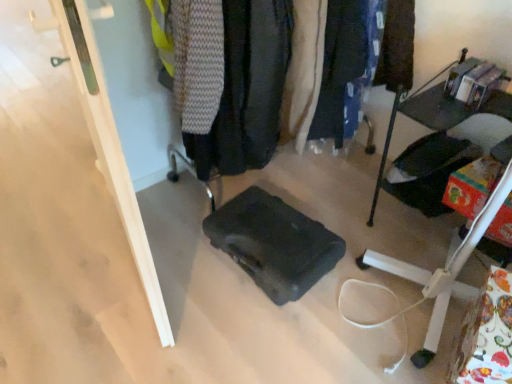
The height and width of the screenshot is (384, 512). What do you see at coordinates (247, 89) in the screenshot?
I see `dark gray fabric jacket at center, placed as the second clothing when sorted from right to left` at bounding box center [247, 89].

Describe the element at coordinates (274, 243) in the screenshot. I see `black matte suitcase at center` at that location.

Describe the element at coordinates (247, 89) in the screenshot. The image size is (512, 384). I see `dark gray fabric at center` at that location.

Identify the location of dark blue fabric pants at center, which is the 1th clothing from right to left. (341, 70).

Which of these two, dark gray fabric jacket at center, placed as the second clothing when sorted from right to left, or metallic black shelf at right, stands taller?

Standing taller between the two is dark gray fabric jacket at center, placed as the second clothing when sorted from right to left.

From a real-world perspective, is dark gray fabric jacket at center, which appears as the 1th clothing when viewed from the left, above or below metallic black shelf at right?

From a real-world perspective, dark gray fabric jacket at center, which appears as the 1th clothing when viewed from the left, is physically above metallic black shelf at right.

Between dark gray fabric jacket at center, placed as the second clothing when sorted from right to left, and metallic black shelf at right, which one has smaller width?

With smaller width is metallic black shelf at right.

Who is more distant, dark gray fabric jacket at center, which appears as the 1th clothing when viewed from the left, or black matte suitcase at center?

black matte suitcase at center.

From the image's perspective, does dark gray fabric jacket at center, placed as the second clothing when sorted from right to left, appear higher than black matte suitcase at center?

Yes, from the image's perspective, dark gray fabric jacket at center, placed as the second clothing when sorted from right to left, is above black matte suitcase at center.

Is dark gray fabric jacket at center, placed as the second clothing when sorted from right to left, taller than black matte suitcase at center?

Indeed, dark gray fabric jacket at center, placed as the second clothing when sorted from right to left, has a greater height compared to black matte suitcase at center.

What's the angular difference between dark gray fabric jacket at center, which appears as the 1th clothing when viewed from the left, and black matte suitcase at center's facing directions?

The angular difference between dark gray fabric jacket at center, which appears as the 1th clothing when viewed from the left, and black matte suitcase at center is 64.2 degrees.

Looking at this image, choose the correct answer: Is dark blue fabric pants at center, which is the 1th clothing from right to left, inside metallic black shelf at right or outside it?

dark blue fabric pants at center, which is the 1th clothing from right to left, lies outside metallic black shelf at right.

From the picture: Visually, is dark blue fabric pants at center, which is the 1th clothing from right to left, positioned to the left or to the right of metallic black shelf at right?

dark blue fabric pants at center, which is the 1th clothing from right to left, is to the left of metallic black shelf at right.

Which is nearer, (349,137) or (490,215)?

Point (349,137) is positioned farther from the camera compared to point (490,215).

Which of these two, dark blue fabric pants at center, which is the 1th clothing from right to left, or metallic black shelf at right, is thinner?

With smaller width is dark blue fabric pants at center, which is the 1th clothing from right to left.

Is metallic black shelf at right outside of dark gray fabric at center?

Yes, metallic black shelf at right is outside of dark gray fabric at center.

Is dark gray fabric at center at the back of metallic black shelf at right?

No.

Which object is thinner, metallic black shelf at right or dark gray fabric at center?

dark gray fabric at center.

Which is farther from the camera, (454, 253) or (264, 125)?

The point (264, 125) is farther from the camera.

Which is closer, (x=307, y=277) or (x=437, y=310)?

Point (x=307, y=277).

Is black matte suitcase at center positioned far away from metallic black shelf at right?

black matte suitcase at center is actually quite close to metallic black shelf at right.

From a real-world perspective, is black matte suitcase at center above or below metallic black shelf at right?

Clearly, from a real-world perspective, black matte suitcase at center is below metallic black shelf at right.

Based on the photo, from the image's perspective, is black matte suitcase at center over metallic black shelf at right?

No, from the image's perspective, black matte suitcase at center is not over metallic black shelf at right.

Is dark gray fabric at center shorter than dark blue fabric pants at center, positioned as the 2th clothing in left-to-right order?

In fact, dark gray fabric at center may be taller than dark blue fabric pants at center, positioned as the 2th clothing in left-to-right order.

Would you say dark gray fabric at center is inside or outside dark blue fabric pants at center, which is the 1th clothing from right to left?

dark gray fabric at center exists outside the volume of dark blue fabric pants at center, which is the 1th clothing from right to left.

Is dark gray fabric at center thinner than dark blue fabric pants at center, positioned as the 2th clothing in left-to-right order?

No.

In the image, is dark gray fabric at center positioned in front of or behind dark blue fabric pants at center, positioned as the 2th clothing in left-to-right order?

Clearly, dark gray fabric at center is in front of dark blue fabric pants at center, positioned as the 2th clothing in left-to-right order.

In the image, is dark blue fabric pants at center, which is the 1th clothing from right to left, on the left side or the right side of black matte suitcase at center?

dark blue fabric pants at center, which is the 1th clothing from right to left, is to the right of black matte suitcase at center.

Based on the photo, from the image's perspective, is dark blue fabric pants at center, positioned as the 2th clothing in left-to-right order, above or below black matte suitcase at center?

dark blue fabric pants at center, positioned as the 2th clothing in left-to-right order, is above black matte suitcase at center.

Which is correct: dark blue fabric pants at center, which is the 1th clothing from right to left, is inside black matte suitcase at center, or outside of it?

dark blue fabric pants at center, which is the 1th clothing from right to left, exists outside the volume of black matte suitcase at center.

Find the location of a particular element. The image size is (512, 384). furniture in front of the dark gray fabric jacket at center, placed as the second clothing when sorted from right to left is located at coordinates (443, 270).

Locate an element on the screen. This screenshot has height=384, width=512. luggage located underneath the dark gray fabric jacket at center, which appears as the 1th clothing when viewed from the left (from a real-world perspective) is located at coordinates (274, 243).

When comparing their distances from dark gray fabric jacket at center, placed as the second clothing when sorted from right to left, does metallic black shelf at right or black matte suitcase at center seem further?

metallic black shelf at right lies further to dark gray fabric jacket at center, placed as the second clothing when sorted from right to left, than the other object.

Based on the photo, considering their positions, is metallic black shelf at right positioned further to dark blue fabric pants at center, positioned as the 2th clothing in left-to-right order, than dark gray fabric at center?

Based on the image, metallic black shelf at right appears to be further to dark blue fabric pants at center, positioned as the 2th clothing in left-to-right order.

Which object lies nearer to the anchor point metallic black shelf at right, dark blue fabric pants at center, positioned as the 2th clothing in left-to-right order, or dark gray fabric jacket at center, placed as the second clothing when sorted from right to left?

The object closer to metallic black shelf at right is dark blue fabric pants at center, positioned as the 2th clothing in left-to-right order.

Estimate the real-world distances between objects in this image. Which object is closer to metallic black shelf at right, black matte suitcase at center or dark gray fabric at center?

Among the two, black matte suitcase at center is located nearer to metallic black shelf at right.

From the image, which object appears to be farther from dark blue fabric pants at center, positioned as the 2th clothing in left-to-right order, dark gray fabric at center or metallic black shelf at right?

metallic black shelf at right lies further to dark blue fabric pants at center, positioned as the 2th clothing in left-to-right order, than the other object.

From the image, which object appears to be nearer to black matte suitcase at center, metallic black shelf at right or dark blue fabric pants at center, positioned as the 2th clothing in left-to-right order?

metallic black shelf at right lies closer to black matte suitcase at center than the other object.

From the image, which object appears to be farther from dark gray fabric jacket at center, placed as the second clothing when sorted from right to left, dark gray fabric at center or dark blue fabric pants at center, positioned as the 2th clothing in left-to-right order?

Among the two, dark blue fabric pants at center, positioned as the 2th clothing in left-to-right order, is located further to dark gray fabric jacket at center, placed as the second clothing when sorted from right to left.

Looking at the image, which one is located closer to metallic black shelf at right, dark blue fabric pants at center, which is the 1th clothing from right to left, or dark gray fabric at center?

dark blue fabric pants at center, which is the 1th clothing from right to left, lies closer to metallic black shelf at right than the other object.

I want to click on clothing located between dark gray fabric at center and metallic black shelf at right in the left-right direction, so click(341, 70).

Where is `clothing between dark gray fabric jacket at center, which appears as the 1th clothing when viewed from the left, and metallic black shelf at right from left to right`? clothing between dark gray fabric jacket at center, which appears as the 1th clothing when viewed from the left, and metallic black shelf at right from left to right is located at coordinates (341, 70).

This screenshot has width=512, height=384. What are the coordinates of `clothing situated between black matte suitcase at center and metallic black shelf at right from left to right` in the screenshot? It's located at (341, 70).

This screenshot has width=512, height=384. Identify the location of luggage located between dark gray fabric jacket at center, placed as the second clothing when sorted from right to left, and metallic black shelf at right in the left-right direction. (274, 243).